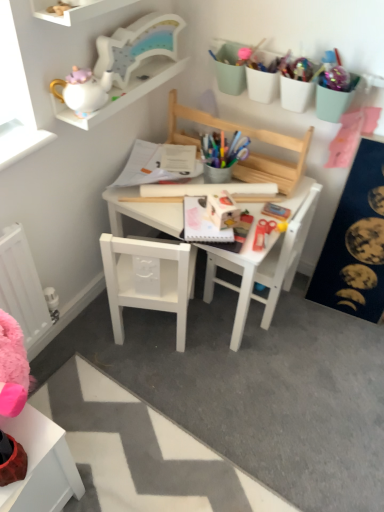
Find the location of a particular element. Image resolution: width=384 pixels, height=512 pixels. free spot in front of white wooden chair at center, which is the second chair from left to right is located at coordinates (259, 353).